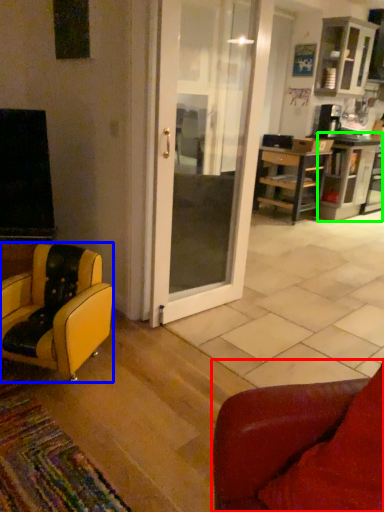
Question: Which is farther away from chair (highlighted by a red box)? chair (highlighted by a blue box) or shelf (highlighted by a green box)?

Choices:
 (A) chair
 (B) shelf

Answer: (B)